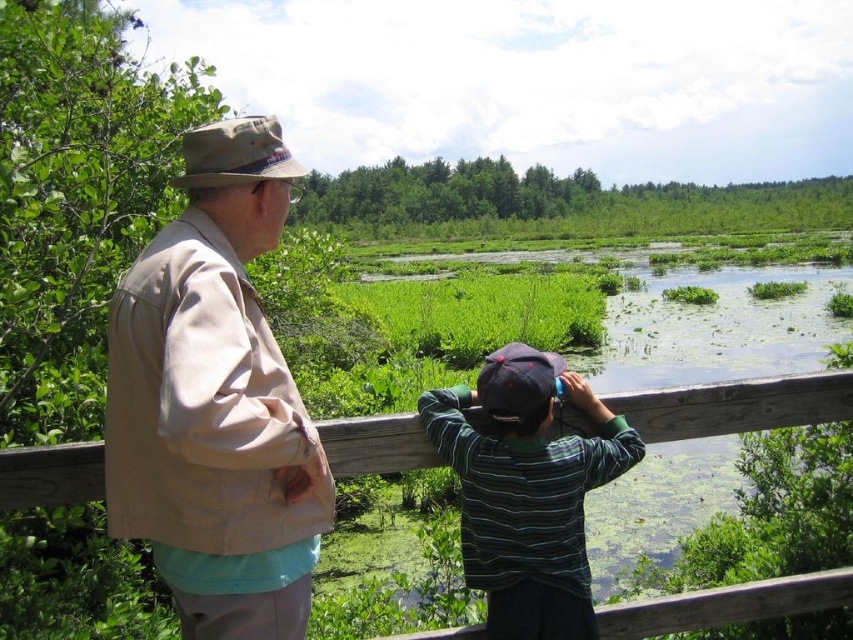
Question: Which object is positioned closest to the khaki fabric jacket at upper left?

Choices:
 (A) wooden fence at center
 (B) green striped shirt at center

Answer: (B)

Question: In this image, where is green striped shirt at center located relative to wooden fence at center?

Choices:
 (A) above
 (B) below

Answer: (B)

Question: Is green striped shirt at center positioned before wooden fence at center?

Choices:
 (A) no
 (B) yes

Answer: (B)

Question: Which object is farther from the camera taking this photo?

Choices:
 (A) khaki fabric jacket at upper left
 (B) wooden fence at center
 (C) green striped shirt at center

Answer: (B)

Question: Among these points, which one is farthest from the camera?

Choices:
 (A) (563, 381)
 (B) (335, 460)

Answer: (A)

Question: Is green striped shirt at center below wooden fence at center?

Choices:
 (A) no
 (B) yes

Answer: (B)